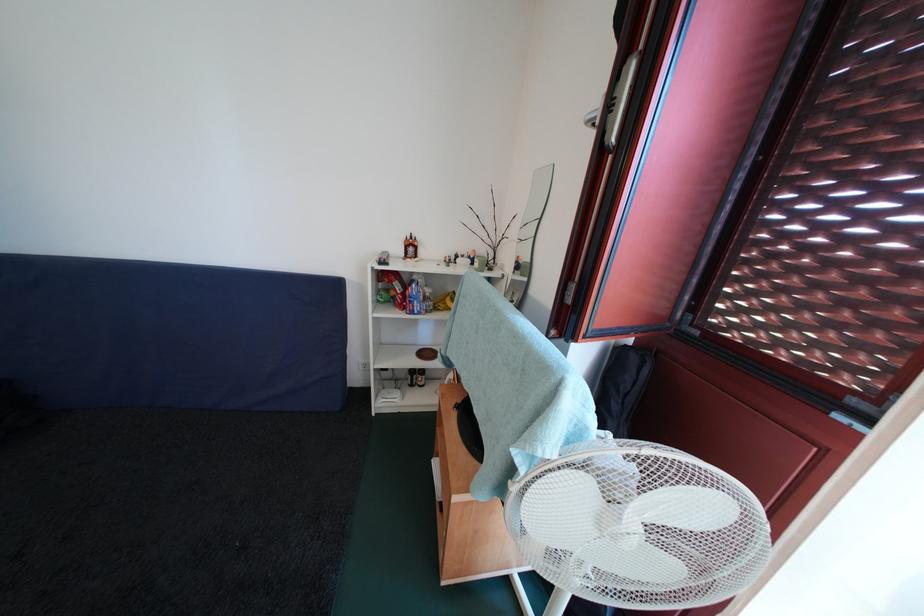
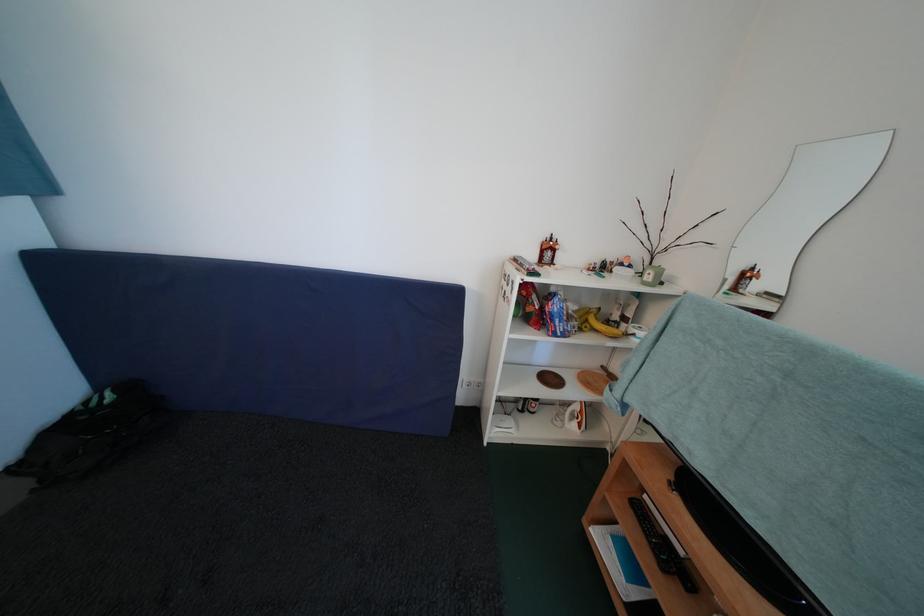
Find the pixel in the second image that matches (457,381) in the first image.

(584, 411)